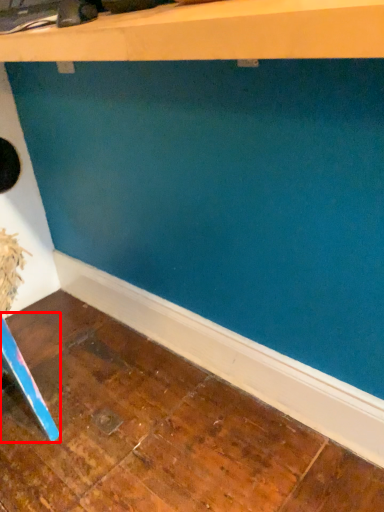
Question: Where is furniture (annotated by the red box) located in relation to shelf in the image?

Choices:
 (A) right
 (B) left

Answer: (B)